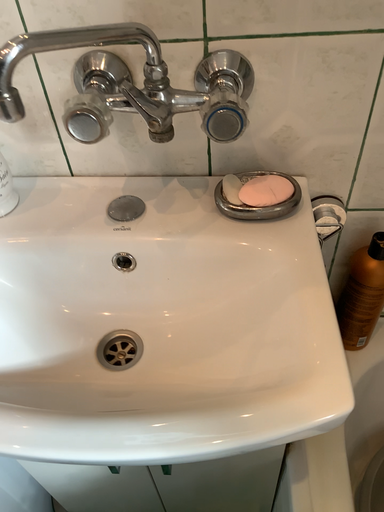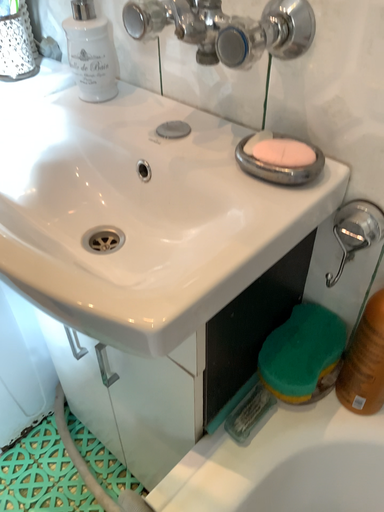
Question: Which way did the camera rotate in the video?

Choices:
 (A) rotated left
 (B) rotated right

Answer: (A)